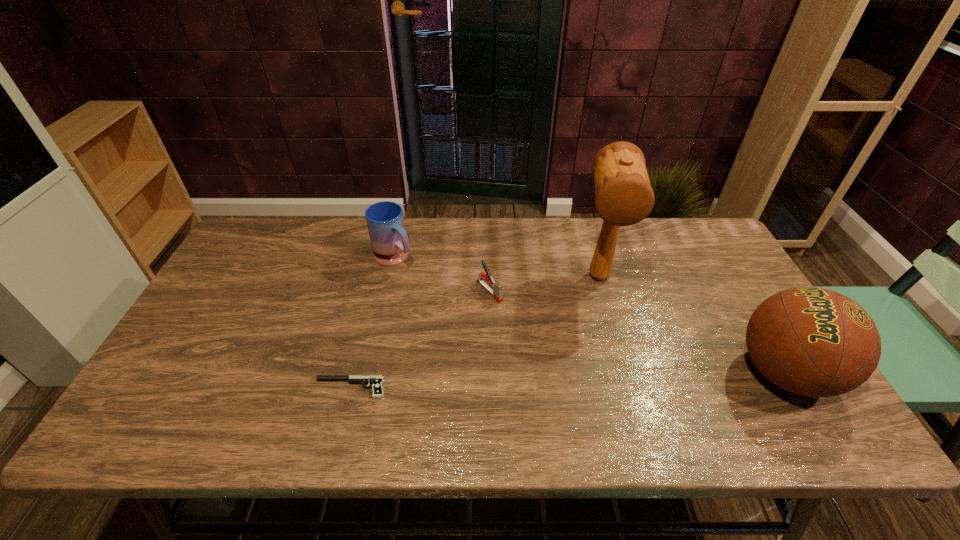
Identify the location of vacant space at the right edge of the desktop. (705, 275).

Find the location of a particular element. blank space at the far left corner is located at coordinates (288, 232).

The height and width of the screenshot is (540, 960). Identify the location of vacant space at the far right corner of the desktop. pos(684,218).

The height and width of the screenshot is (540, 960). I want to click on blank area at the near right corner, so click(759, 393).

You are a GUI agent. You are given a task and a screenshot of the screen. Output one action in this format:
    pyautogui.click(x=<x>, y=<y>)
    Task: Click on the empty space between the mug and the rightmost object
    This screenshot has height=540, width=960.
    Given the screenshot: What is the action you would take?
    pyautogui.click(x=589, y=316)

Image resolution: width=960 pixels, height=540 pixels. What are the coordinates of `free space between the rightmost object and the second object from right to left` in the screenshot? It's located at (691, 325).

Locate an element on the screen. The height and width of the screenshot is (540, 960). vacant point located between the second shortest object and the shortest object is located at coordinates (420, 340).

Image resolution: width=960 pixels, height=540 pixels. In order to click on free spot between the shortest object and the mallet in this screenshot , I will do `click(474, 332)`.

Identify the location of empty location between the second shortest object and the basketball. The height and width of the screenshot is (540, 960). (636, 332).

Locate an element on the screen. Image resolution: width=960 pixels, height=540 pixels. empty location between the third object from left to right and the third tallest object is located at coordinates (442, 275).